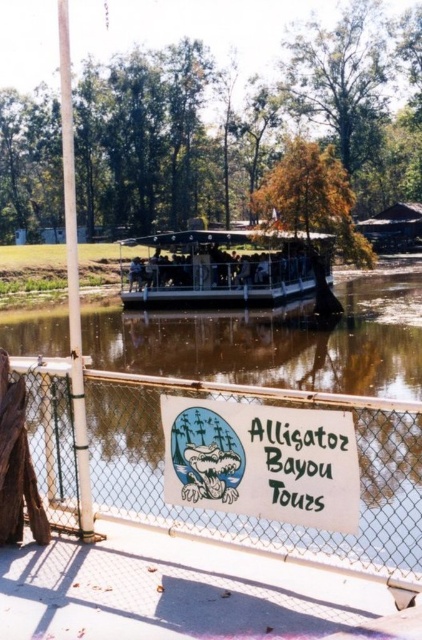
Is point (154, 472) less distant than point (121, 269)?

Yes, point (154, 472) is in front of point (121, 269).

Does white chain-link fence at center have a smaller size compared to white plastic boat at center?

Correct, white chain-link fence at center occupies less space than white plastic boat at center.

Does point (414, 426) lie behind point (260, 246)?

No, it is not.

Identify the location of white chain-link fence at center. The height and width of the screenshot is (640, 422). (249, 516).

Does white paper sign at center have a lesser width compared to white plastic boat at center?

Yes, white paper sign at center is thinner than white plastic boat at center.

Is point (213, 432) more distant than point (137, 240)?

That is False.

Locate an element on the screen. Image resolution: width=422 pixels, height=640 pixels. white paper sign at center is located at coordinates (262, 461).

Does white chain-link fence at center have a lesser width compared to white paper sign at center?

No.

Who is taller, white chain-link fence at center or white paper sign at center?

With more height is white chain-link fence at center.

Between point (376, 538) and point (214, 454), which one is positioned behind?

Positioned behind is point (214, 454).

Locate an element on the screen. This screenshot has height=640, width=422. white chain-link fence at center is located at coordinates (249, 516).